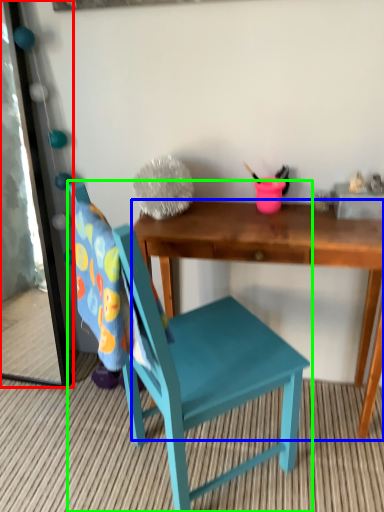
Question: Which object is the closest to the mirror (highlighted by a red box)? Choose among these: desk (highlighted by a blue box) or chair (highlighted by a green box).

Choices:
 (A) desk
 (B) chair

Answer: (B)